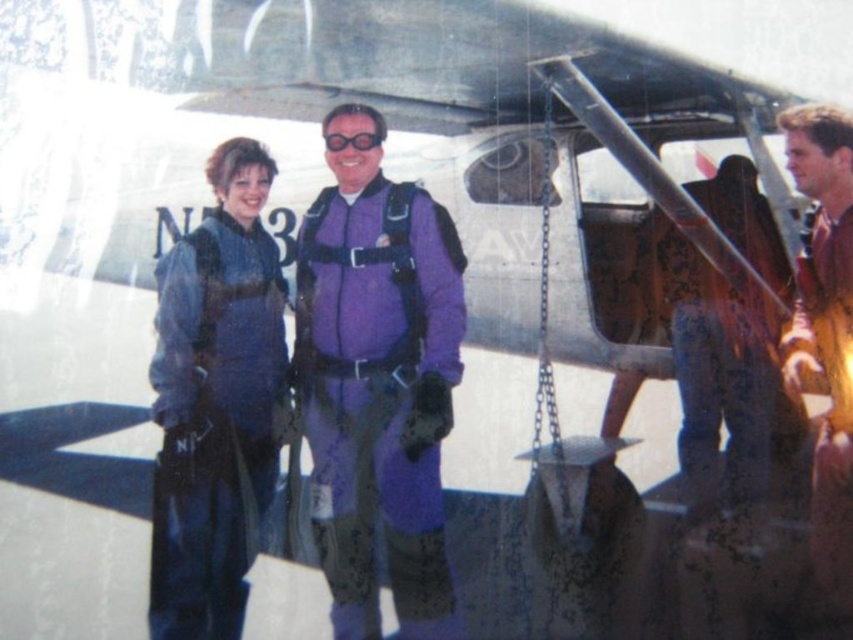
You are a skydiving instructor assessing the equipment setup of your students. You notice the purple matte jumpsuit at center and the clear plastic goggles at center. Are the goggles positioned closer to your face than the recommended 28 inches?

The purple matte jumpsuit at center and clear plastic goggles at center are 27.43 inches apart, so yes, the goggles are positioned closer to the face than the recommended 28 inches.

You are a skydiving instructor assessing the equipment setup. You notice the brown leather jacket at right and the clear plastic goggles at center. Which item is narrower in width?

The brown leather jacket at right is thinner than clear plastic goggles at center, so the brown leather jacket at right is narrower in width.